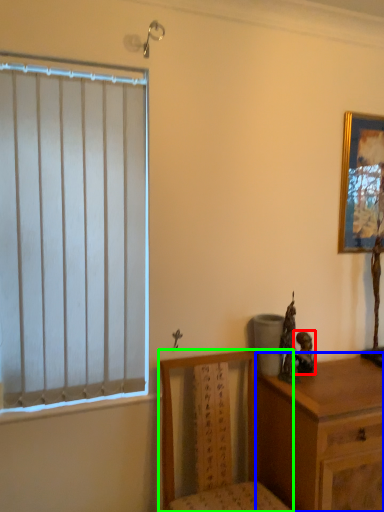
Question: Considering the real-world distances, which object is closest to figurine (highlighted by a red box)? chest of drawers (highlighted by a blue box) or chair (highlighted by a green box).

Choices:
 (A) chest of drawers
 (B) chair

Answer: (A)